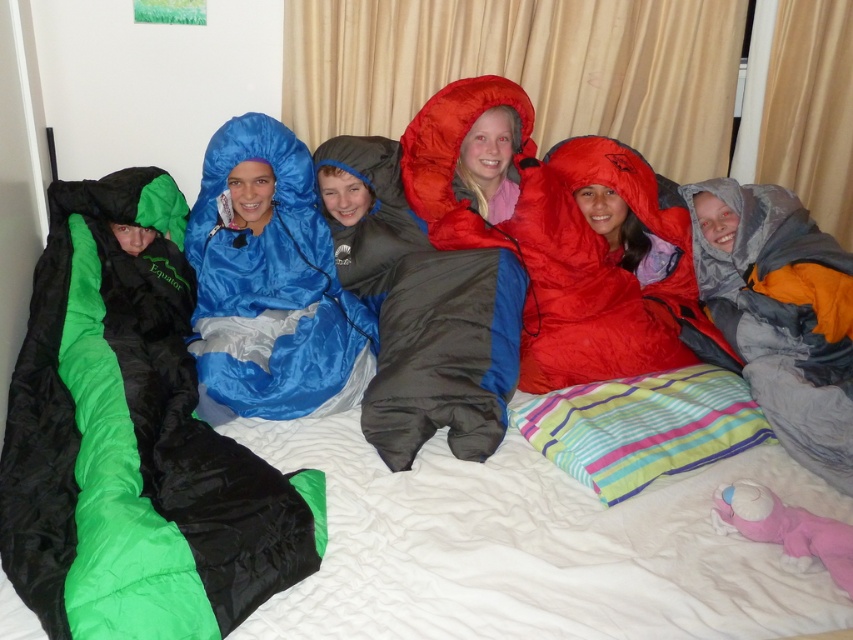
Which is above, black/green nylon sleeping bag at left or gray fabric raincoat at right?

Positioned higher is gray fabric raincoat at right.

Does black/green nylon sleeping bag at left have a smaller size compared to gray fabric raincoat at right?

Incorrect, black/green nylon sleeping bag at left is not smaller in size than gray fabric raincoat at right.

Between point (86, 282) and point (746, 250), which one is positioned behind?

Point (746, 250)

Identify the location of black/green nylon sleeping bag at left. (132, 442).